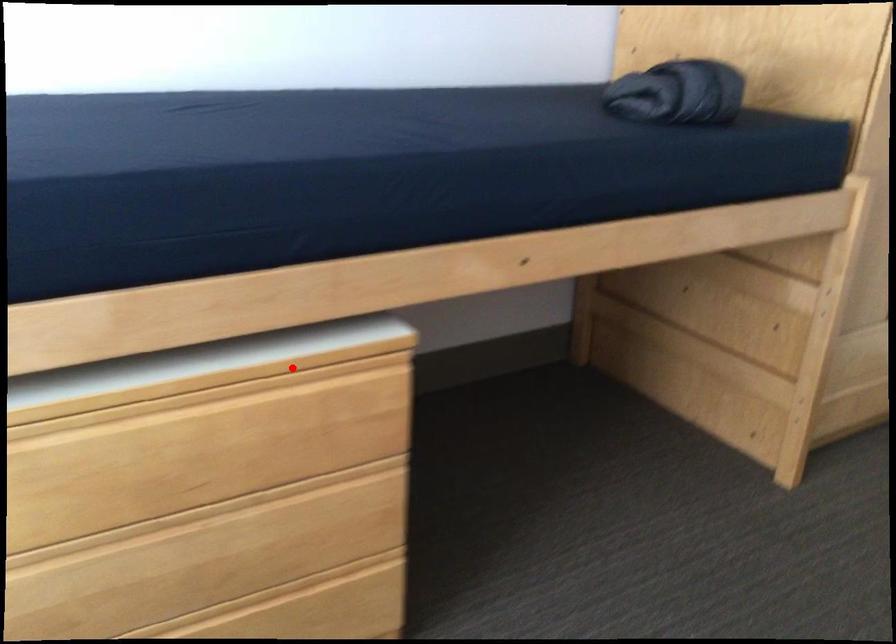
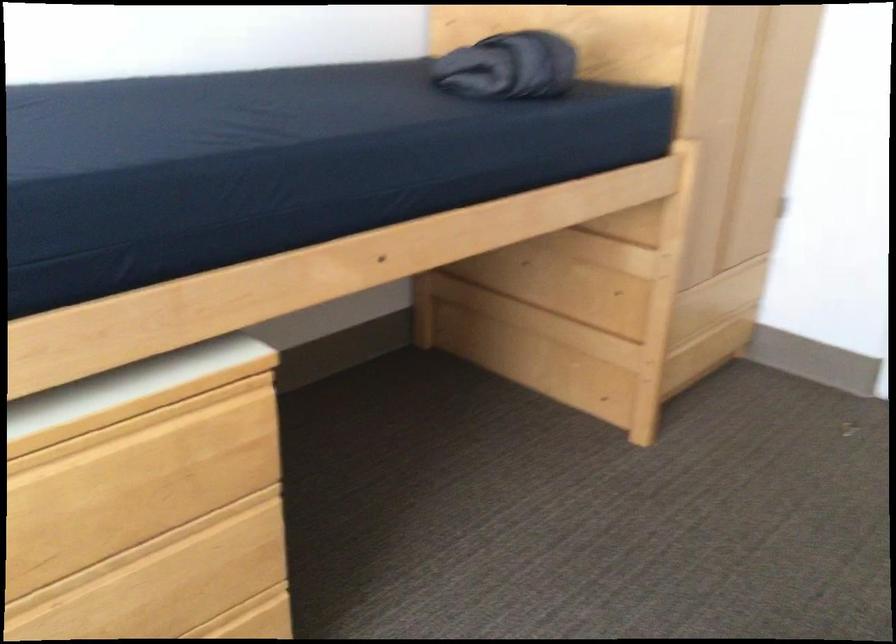
Question: I am providing you with two images of the same scene from different viewpoints. In image1, a red point is highlighted. Considering the same 3D point in image2, which of the following is correct?

Choices:
 (A) It is closer
 (B) It is farther

Answer: (A)